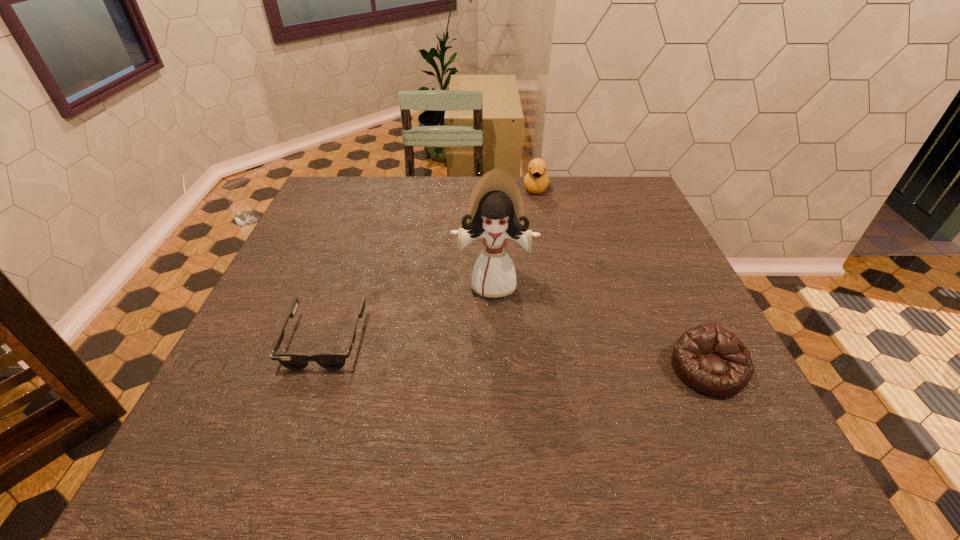
The height and width of the screenshot is (540, 960). Find the location of `the leftmost object`. the leftmost object is located at coordinates (295, 361).

Where is `sunglasses`? The height and width of the screenshot is (540, 960). sunglasses is located at coordinates (295, 361).

Find the location of a particular element. the rightmost object is located at coordinates (710, 359).

The image size is (960, 540). I want to click on the second shortest object, so click(710, 359).

Find the location of `the farthest object`. the farthest object is located at coordinates (536, 180).

You are a GUI agent. You are given a task and a screenshot of the screen. Output one action in this format:
    pyautogui.click(x=<x>, y=<y>)
    Task: Click on the third shortest object
    
    Given the screenshot: What is the action you would take?
    pyautogui.click(x=536, y=180)

The height and width of the screenshot is (540, 960). I want to click on doll, so pos(495,212).

This screenshot has height=540, width=960. What are the coordinates of `the third object from right to left` in the screenshot? It's located at (495, 212).

Where is `free spot located 0.050m on the temples of the shortest object`? This screenshot has width=960, height=540. free spot located 0.050m on the temples of the shortest object is located at coordinates (306, 394).

The height and width of the screenshot is (540, 960). Find the location of `free space located on the left of the second shortest object`. free space located on the left of the second shortest object is located at coordinates (481, 369).